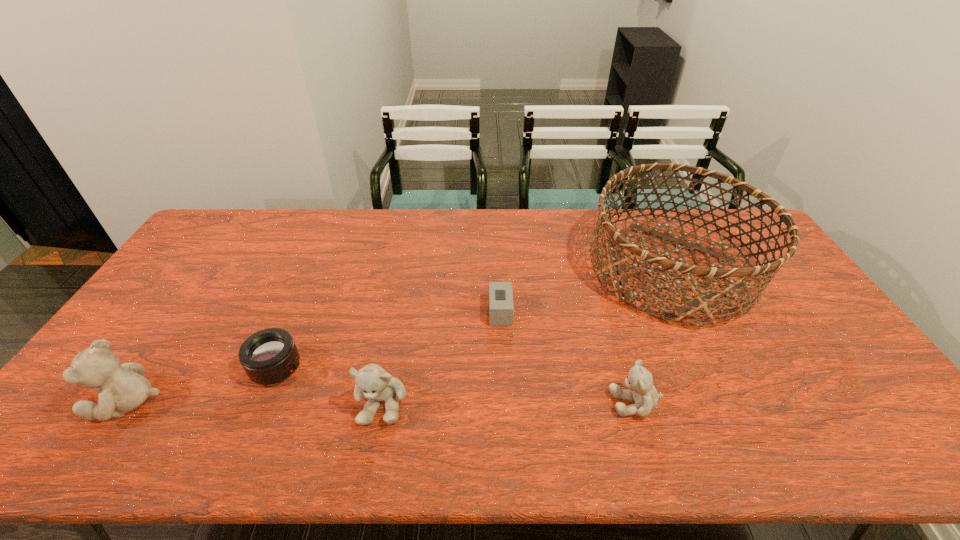
In order to click on vacant space that's between the alarm clock and the basket in this screenshot , I will do `click(586, 291)`.

This screenshot has height=540, width=960. I want to click on free space between the leftmost teddy bear and the third object from left to right, so click(x=255, y=402).

The width and height of the screenshot is (960, 540). I want to click on unoccupied area between the third tallest object and the tallest object, so click(x=526, y=335).

This screenshot has height=540, width=960. What are the coordinates of `empty space that is in between the alarm clock and the basket` in the screenshot? It's located at (586, 291).

At what (x,y) coordinates should I click in order to perform the action: click on vacant area that lies between the tallest object and the shortest object. Please return your answer as a coordinate pair (x, y). The image size is (960, 540). Looking at the image, I should click on (586, 291).

Locate an element on the screen. This screenshot has width=960, height=540. free spot between the shortest teddy bear and the alarm clock is located at coordinates (568, 357).

Locate an element on the screen. free spot between the fifth tallest object and the tallest object is located at coordinates (473, 319).

Locate an element on the screen. The width and height of the screenshot is (960, 540). free point between the basket and the telephoto lens is located at coordinates (473, 319).

Find the location of a particular element. This screenshot has width=960, height=540. vacant point located between the leftmost object and the second teddy bear from left to right is located at coordinates (255, 402).

Locate which object is the second closest to the basket. Please provide its 2D coordinates. Your answer should be formatted as a tuple, i.e. [(x, y)], where the tuple contains the x and y coordinates of a point satisfying the conditions above.

[(501, 309)]